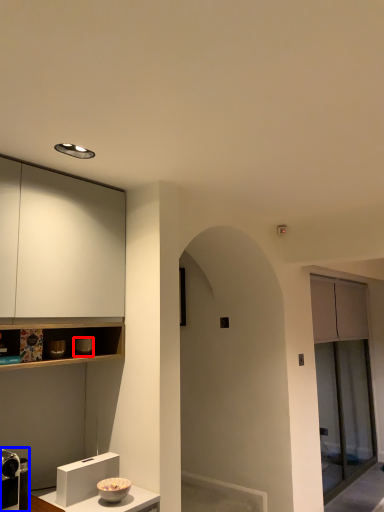
Question: Which object is closer to the camera taking this photo, appliance (highlighted by a red box) or appliance (highlighted by a blue box)?

Choices:
 (A) appliance
 (B) appliance

Answer: (B)